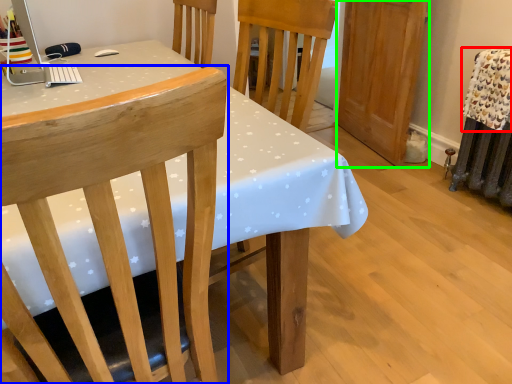
Question: Which is farther away from blanket (highlighted by a red box)? chair (highlighted by a blue box) or armoire (highlighted by a green box)?

Choices:
 (A) chair
 (B) armoire

Answer: (A)